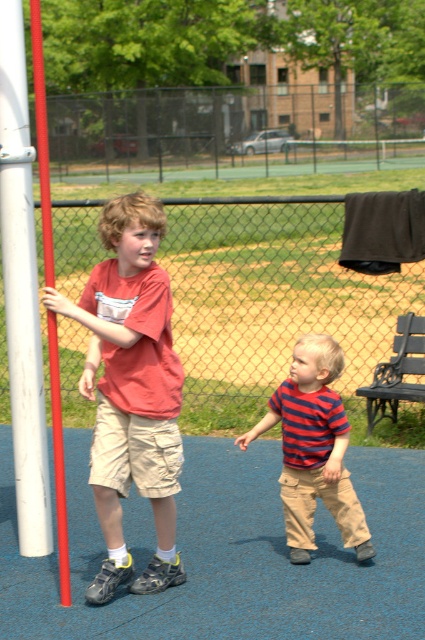
You are a photographer trying to capture a photo of the striped cotton shirt at center and the white smooth pole at left. Which object should you focus on first if you want to ensure both are in the frame without moving the camera?

You should focus on the white smooth pole at left first because the striped cotton shirt at center has a lesser width, making it smaller and easier to fit within the frame while ensuring the wider white smooth pole at left is also captured.